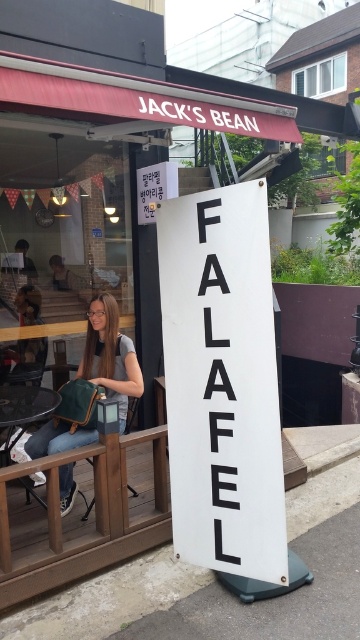
Question: Which point is farther to the camera?

Choices:
 (A) white matte sign at center
 (B) matte green bag at left

Answer: (B)

Question: Can you confirm if white matte sign at center is positioned below matte green bag at left?

Choices:
 (A) no
 (B) yes

Answer: (A)

Question: Which point appears closest to the camera in this image?

Choices:
 (A) (210, 369)
 (B) (125, 374)

Answer: (A)

Question: Observing the image, what is the correct spatial positioning of white matte sign at center in reference to matte green bag at left?

Choices:
 (A) left
 (B) right

Answer: (B)

Question: Which point is farther from the camera taking this photo?

Choices:
 (A) (232, 484)
 (B) (110, 396)

Answer: (B)

Question: Is white matte sign at center further to camera compared to matte green bag at left?

Choices:
 (A) no
 (B) yes

Answer: (A)